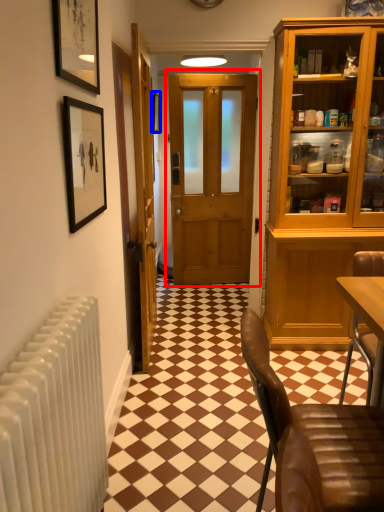
Question: Among these objects, which one is nearest to the camera, door (highlighted by a red box) or picture frame (highlighted by a blue box)?

Choices:
 (A) door
 (B) picture frame

Answer: (A)